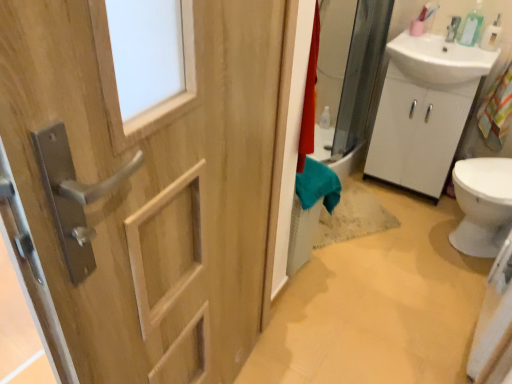
You are a GUI agent. You are given a task and a screenshot of the screen. Output one action in this format:
    pyautogui.click(x=<x>, y=<y>)
    Task: Click on the natural wood door at left
    This screenshot has width=512, height=384.
    Given the screenshot: What is the action you would take?
    pyautogui.click(x=140, y=191)

Identify the location of white glossy sink at upper right. (439, 59).

Image resolution: width=512 pixels, height=384 pixels. What are the coordinates of `white matte cabinet at right` in the screenshot? It's located at (418, 130).

Which of these two, white matte cabinet at right or white glossy sink at upper right, is thinner?

white matte cabinet at right.

Are white matte cabinet at right and white glossy sink at upper right beside each other?

They are not placed beside each other.

Is white glossy sink at upper right at the back of white matte cabinet at right?

No, white matte cabinet at right's orientation is not away from white glossy sink at upper right.

From a real-world perspective, is white matte cabinet at right on top of white glossy sink at upper right?

No.

Is white glossy sink at upper right taller than clear plastic soap dispenser at upper right?

Correct, white glossy sink at upper right is much taller as clear plastic soap dispenser at upper right.

Is white glossy sink at upper right in front of or behind clear plastic soap dispenser at upper right in the image?

Clearly, white glossy sink at upper right is in front of clear plastic soap dispenser at upper right.

What's the angular difference between white glossy sink at upper right and clear plastic soap dispenser at upper right's facing directions?

The facing directions of white glossy sink at upper right and clear plastic soap dispenser at upper right are 0.0013 degrees apart.

Which point is more distant from viewer, (490, 69) or (481, 23)?

Positioned behind is point (481, 23).

Looking at their sizes, would you say white plastic bottle at upper right is wider or thinner than white matte cabinet at right?

In the image, white plastic bottle at upper right appears to be more narrow than white matte cabinet at right.

Is white plastic bottle at upper right spatially inside white matte cabinet at right, or outside of it?

white plastic bottle at upper right is located beyond the bounds of white matte cabinet at right.

Which of these two, white plastic bottle at upper right or white matte cabinet at right, is bigger?

Bigger between the two is white matte cabinet at right.

Could you tell me if white plastic bottle at upper right is facing white matte cabinet at right?

No, white plastic bottle at upper right is not aimed at white matte cabinet at right.

Is natural wood door at left wider or thinner than white matte cabinet at right?

Considering their sizes, natural wood door at left looks slimmer than white matte cabinet at right.

Considering the sizes of objects natural wood door at left and white matte cabinet at right in the image provided, who is shorter, natural wood door at left or white matte cabinet at right?

Standing shorter between the two is white matte cabinet at right.

Who is smaller, natural wood door at left or white matte cabinet at right?

With smaller size is natural wood door at left.

From the picture: What's the angular difference between natural wood door at left and white matte cabinet at right's facing directions?

97.8 degrees separate the facing orientations of natural wood door at left and white matte cabinet at right.

Is natural wood door at left oriented away from clear plastic soap dispenser at upper right?

natural wood door at left does not have its back to clear plastic soap dispenser at upper right.

From a real-world perspective, which is physically above, natural wood door at left or clear plastic soap dispenser at upper right?

In real-world perspective, clear plastic soap dispenser at upper right is above.

Where is `door to the left of clear plastic soap dispenser at upper right`? door to the left of clear plastic soap dispenser at upper right is located at coordinates (140, 191).

Between natural wood door at left and clear plastic soap dispenser at upper right, which one appears on the right side from the viewer's perspective?

clear plastic soap dispenser at upper right is more to the right.

Which point is more distant from viewer, (470, 26) or (479, 55)?

Point (479, 55)

You are a GUI agent. You are given a task and a screenshot of the screen. Output one action in this format:
    pyautogui.click(x=<x>, y=<y>)
    Task: Click on the sink on the left of clear plastic soap dispenser at upper right
    The height and width of the screenshot is (384, 512).
    Given the screenshot: What is the action you would take?
    pyautogui.click(x=439, y=59)

Is clear plastic soap dispenser at upper right next to white glossy sink at upper right and touching it?

No, clear plastic soap dispenser at upper right is not making contact with white glossy sink at upper right.

Is white glossy sink at upper right inside clear plastic soap dispenser at upper right?

No, clear plastic soap dispenser at upper right does not contain white glossy sink at upper right.

Is natural wood door at left wider than white plastic bottle at upper right?

Correct, the width of natural wood door at left exceeds that of white plastic bottle at upper right.

Is natural wood door at left facing away from white plastic bottle at upper right?

No, natural wood door at left is not facing the opposite direction of white plastic bottle at upper right.

Is natural wood door at left bigger or smaller than white plastic bottle at upper right?

Clearly, natural wood door at left is larger in size than white plastic bottle at upper right.

Which object is positioned more to the right, natural wood door at left or white plastic bottle at upper right?

From the viewer's perspective, white plastic bottle at upper right appears more on the right side.

This screenshot has height=384, width=512. Find the location of `bathroom cabinet located behind the white glossy sink at upper right`. bathroom cabinet located behind the white glossy sink at upper right is located at coordinates (418, 130).

You are a GUI agent. You are given a task and a screenshot of the screen. Output one action in this format:
    pyautogui.click(x=<x>, y=<y>)
    Task: Click on the soap dispenser above the white glossy sink at upper right (from a real-world perspective)
    Image resolution: width=512 pixels, height=384 pixels.
    Given the screenshot: What is the action you would take?
    pyautogui.click(x=472, y=26)

Based on their spatial positions, is white matte cabinet at right or natural wood door at left closer to white glossy sink at upper right?

The object closer to white glossy sink at upper right is white matte cabinet at right.

Considering their positions, is natural wood door at left positioned closer to white matte cabinet at right than white plastic bottle at upper right?

Based on the image, white plastic bottle at upper right appears to be nearer to white matte cabinet at right.

Considering their positions, is clear plastic soap dispenser at upper right positioned closer to natural wood door at left than white glossy sink at upper right?

The object closer to natural wood door at left is white glossy sink at upper right.

When comparing their distances from white glossy sink at upper right, does white plastic bottle at upper right or natural wood door at left seem further?

The object further to white glossy sink at upper right is natural wood door at left.

Looking at the image, which one is located closer to clear plastic soap dispenser at upper right, white plastic bottle at upper right or natural wood door at left?

The object closer to clear plastic soap dispenser at upper right is white plastic bottle at upper right.

Based on their spatial positions, is white matte cabinet at right or white plastic bottle at upper right further from clear plastic soap dispenser at upper right?

white matte cabinet at right is further to clear plastic soap dispenser at upper right.

Considering their positions, is natural wood door at left positioned closer to white glossy sink at upper right than clear plastic soap dispenser at upper right?

The object closer to white glossy sink at upper right is clear plastic soap dispenser at upper right.

Which object lies nearer to the anchor point white plastic bottle at upper right, white matte cabinet at right or clear plastic soap dispenser at upper right?

Among the two, clear plastic soap dispenser at upper right is located nearer to white plastic bottle at upper right.

The height and width of the screenshot is (384, 512). What are the coordinates of `sink positioned between natural wood door at left and white plastic bottle at upper right from near to far` in the screenshot? It's located at (439, 59).

The image size is (512, 384). What are the coordinates of `sink located between natural wood door at left and clear plastic soap dispenser at upper right in the depth direction` in the screenshot? It's located at (439, 59).

The width and height of the screenshot is (512, 384). Find the location of `sink between clear plastic soap dispenser at upper right and white matte cabinet at right in the vertical direction`. sink between clear plastic soap dispenser at upper right and white matte cabinet at right in the vertical direction is located at coordinates (439, 59).

Where is `toiletry that lies between clear plastic soap dispenser at upper right and white matte cabinet at right from top to bottom`? The image size is (512, 384). toiletry that lies between clear plastic soap dispenser at upper right and white matte cabinet at right from top to bottom is located at coordinates (490, 35).